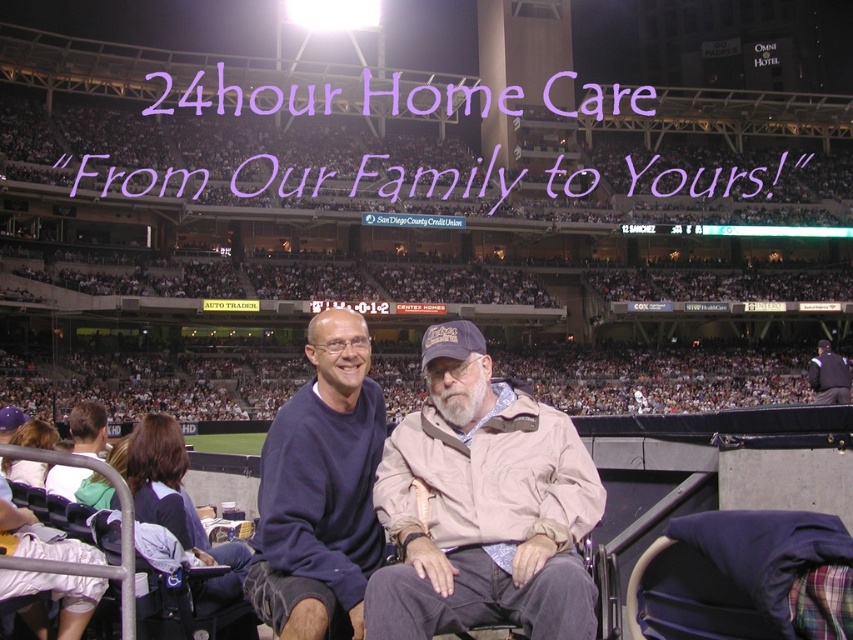
Who is more distant from viewer, (x=61, y=468) or (x=846, y=385)?

Positioned behind is point (x=846, y=385).

Does light blue shirt at lower left appear on the right side of dark blue uniform at center?

No, light blue shirt at lower left is not to the right of dark blue uniform at center.

Where is `light blue shirt at lower left`? This screenshot has width=853, height=640. light blue shirt at lower left is located at coordinates (88, 428).

Image resolution: width=853 pixels, height=640 pixels. Identify the location of light blue shirt at lower left. (88, 428).

Does beige fabric jacket at center have a larger size compared to dark blue uniform at center?

Actually, beige fabric jacket at center might be smaller than dark blue uniform at center.

Is beige fabric jacket at center smaller than dark blue uniform at center?

Yes, beige fabric jacket at center is smaller than dark blue uniform at center.

The width and height of the screenshot is (853, 640). Find the location of `beige fabric jacket at center`. beige fabric jacket at center is located at coordinates (482, 506).

Find the location of a particular element. This screenshot has width=853, height=640. beige fabric jacket at center is located at coordinates (482, 506).

Which is in front, point (264, 476) or point (94, 436)?

Point (264, 476) is in front.

Who is lower down, navy blue sweatshirt at center or light blue shirt at lower left?

navy blue sweatshirt at center is below.

Is point (358, 588) positioned in front of point (49, 483)?

Yes, it is.

Find the location of `navy blue sweatshirt at center`. navy blue sweatshirt at center is located at coordinates (320, 490).